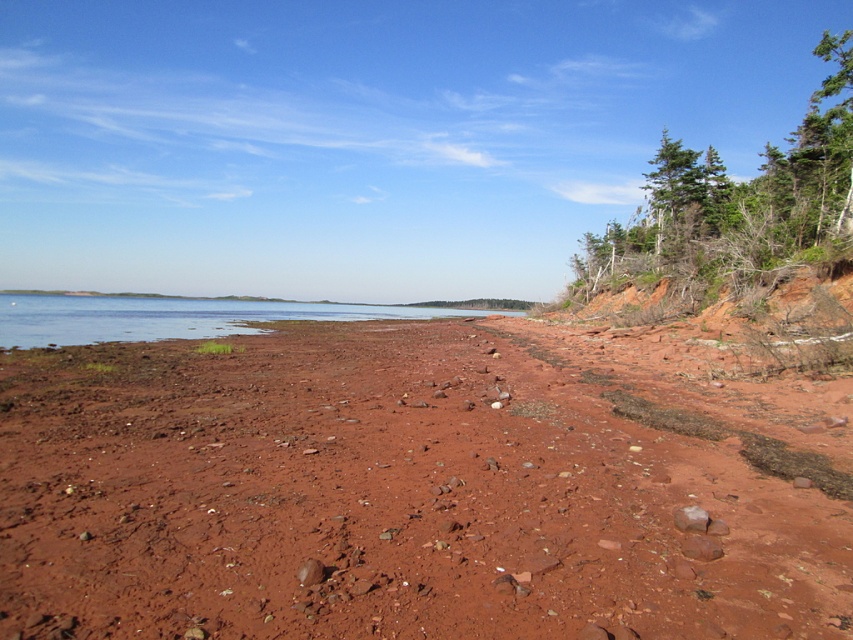
You are standing on the beach and want to reach the point marked as point (x=437, y=550). If your walking speed is 1.5 meters per second, how many seconds will it take you to reach that point?

The point (x=437, y=550) is 4.08 meters away from the camera. At a walking speed of 1.5 meters per second, it would take approximately 2.72 seconds to reach it.